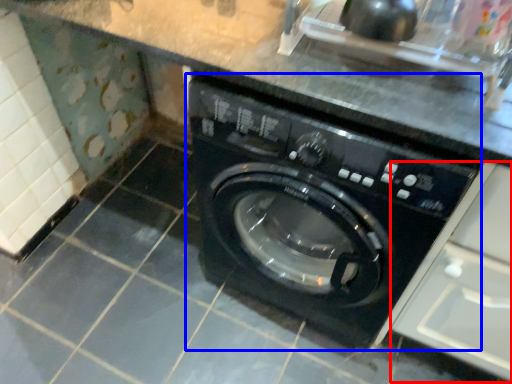
Question: Which point is further to the camera, drawer (highlighted by a red box) or washing machine (highlighted by a blue box)?

Choices:
 (A) drawer
 (B) washing machine

Answer: (B)